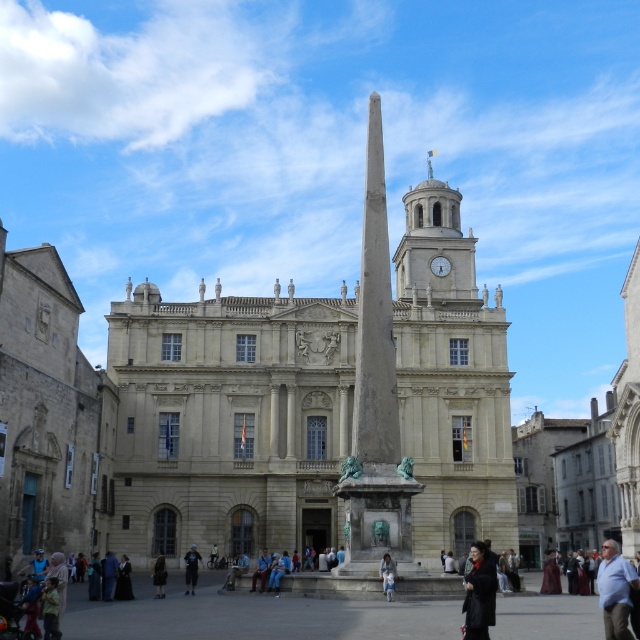
You are a photographer standing in the public square. You want to capture a photo of the gray stone obelisk at center from a distance that allows you to include the entire monument in your shot. If your camera has a maximum zoom range of 50 meters, can you fit the obelisk into your photo without moving closer?

The gray stone obelisk at center is 58.88 meters from the camera. Since the camera can only zoom up to 50 meters, the photographer cannot capture the entire obelisk in the photo without moving closer.

You are a photographer standing in the public square and want to capture both the dark blue jeans at center and the blue denim jeans at center in a single photo. Which of the two jeans should be positioned closer to the camera to ensure both are visible clearly?

The dark blue jeans at center should be positioned closer to the camera because the blue denim jeans at center is behind it, so placing the dark blue jeans at center in front will ensure both are visible without one blocking the other.